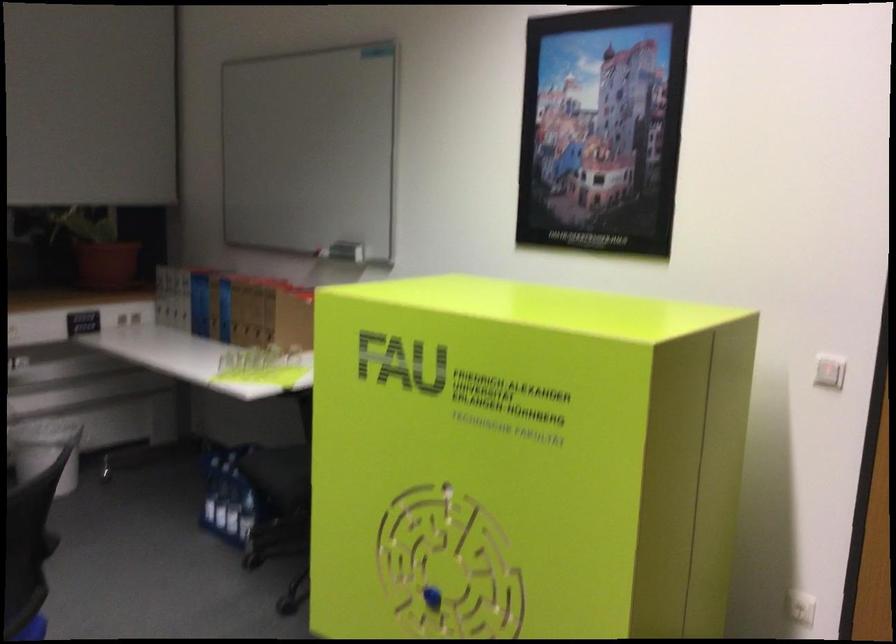
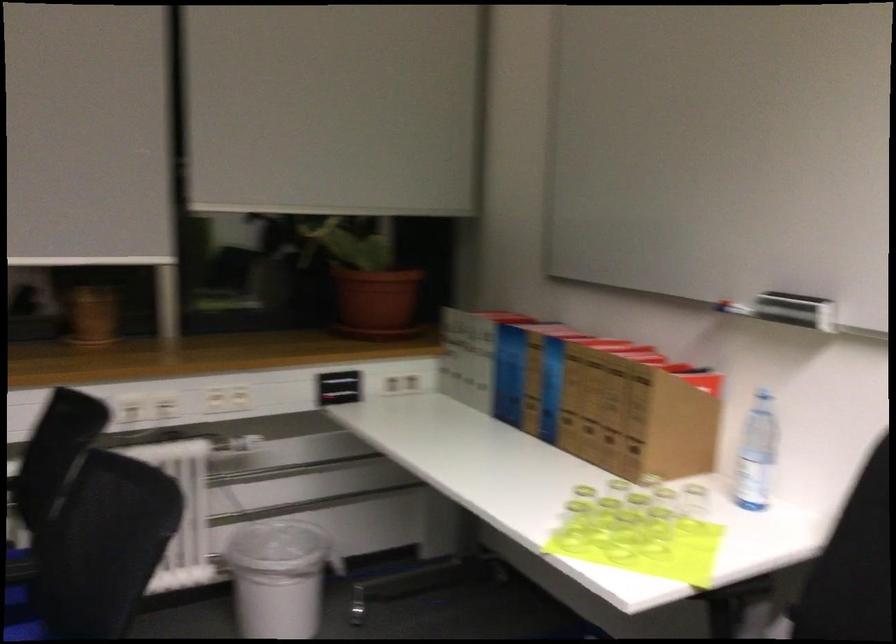
Find the pixel in the second image that matches [88,324] in the first image.

(339, 386)